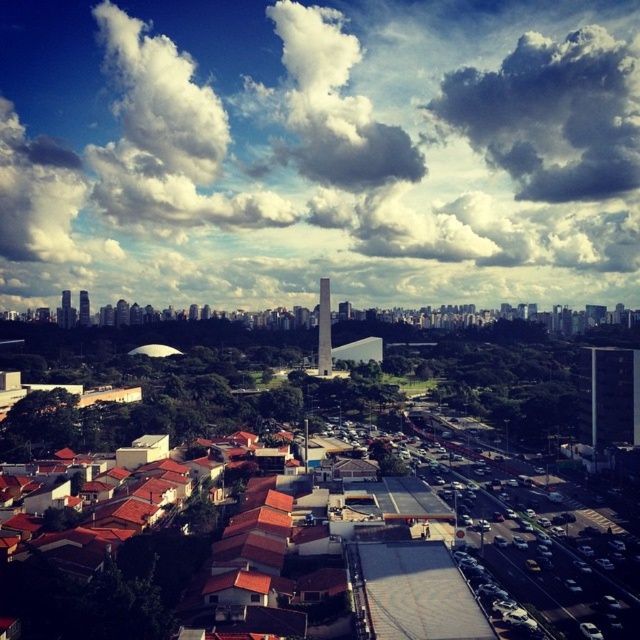
You are a drone operator trying to capture a photo of the white fluffy cloud at upper center from the ground level. The drone has a maximum flight range of 500 meters. Can your drone reach the cloud?

The white fluffy cloud at upper center and camera are 480.12 meters apart from each other. Since the drone can fly up to 500 meters, it can reach the cloud as 480.12 meters is within the 500 meters range.

You are standing in the cityscape scene and want to take a photo. You notice two points marked in the image. Which point is closer to your camera, point 1 at coordinates point 1 at coordinates point (64, 292) or point 2 at coordinates point (81, 308)?

Point (64, 292) is further to the camera than point (81, 308), so the closer point to the camera is point (81, 308).

You are an architect designing a new building in the city. You want to ensure that the new building doesn not block the view of the cloudy sky at upper center from the matte gray tower at left. Given the spatial relationship between these two elements, what should you consider about their widths?

Since the cloudy sky at upper center is wider than the matte gray tower at left, you should ensure the new building does not obstruct the wider cloudy sky at upper center when viewed from the matte gray tower at left.